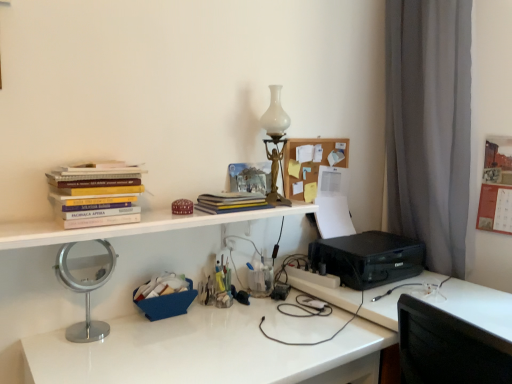
This screenshot has width=512, height=384. What are the coordinates of `free spot in front of silver metallic mirror at lower left` in the screenshot? It's located at 77,360.